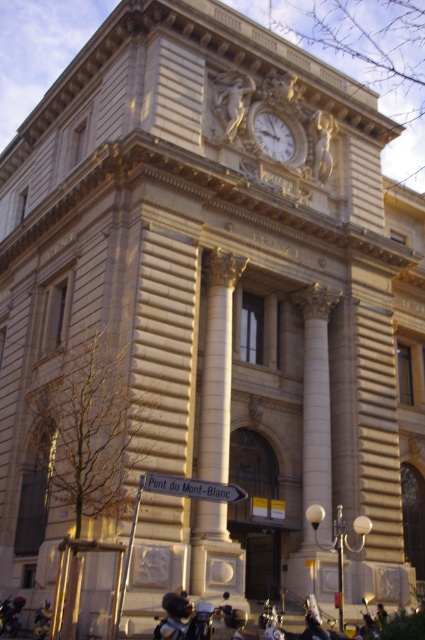
Question: Can you confirm if shiny black motorcycle at lower center is bigger than white glossy clock at upper center?

Choices:
 (A) yes
 (B) no

Answer: (A)

Question: Which of the following is the closest to the observer?

Choices:
 (A) golden stone column at center
 (B) shiny black motorcycle at lower left
 (C) shiny black motorcycle at lower center

Answer: (C)

Question: Which of the following is the farthest from the observer?

Choices:
 (A) golden stone column at center
 (B) white glossy clock at upper center
 (C) shiny black motorcycle at lower center
 (D) shiny black motorcycle at lower left

Answer: (B)

Question: Can you confirm if golden stone column at center is positioned to the left of white glossy clock at upper center?

Choices:
 (A) yes
 (B) no

Answer: (A)

Question: Which of the following is the farthest from the observer?

Choices:
 (A) (158, 618)
 (B) (272, 134)
 (C) (5, 609)
 (D) (209, 353)

Answer: (B)

Question: Does golden stone column at center have a smaller size compared to white glossy clock at upper center?

Choices:
 (A) yes
 (B) no

Answer: (B)